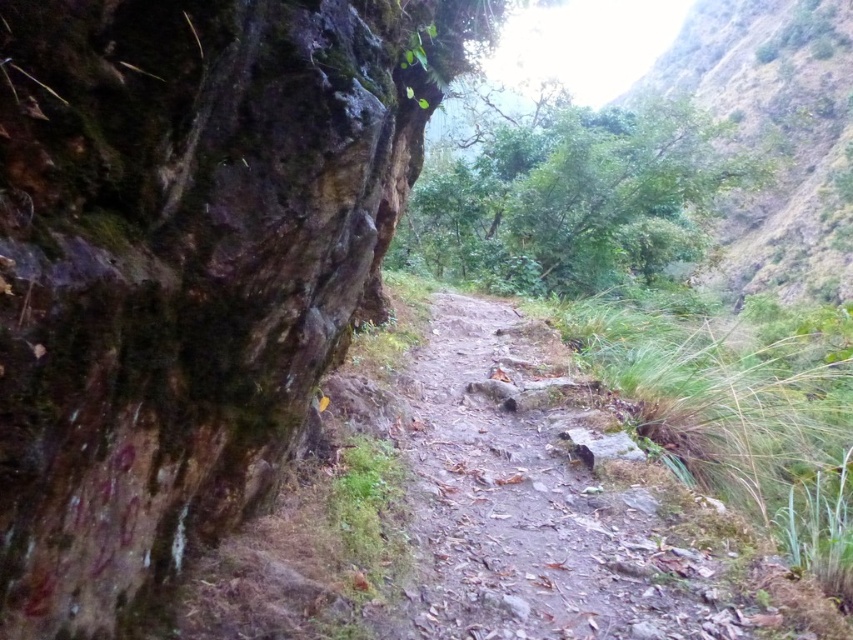
Is point (131, 611) positioned behind point (746, 58)?

No, (131, 611) is in front of (746, 58).

Which is behind, point (38, 353) or point (785, 99)?

The point (785, 99) is more distant.

Where is `green mossy rock at left`? Image resolution: width=853 pixels, height=640 pixels. green mossy rock at left is located at coordinates (184, 262).

Is dusty gravel path at center shorter than green leafy hillside at upper right?

Indeed, dusty gravel path at center has a lesser height compared to green leafy hillside at upper right.

Is the position of dusty gravel path at center less distant than that of green leafy hillside at upper right?

Yes, dusty gravel path at center is in front of green leafy hillside at upper right.

This screenshot has height=640, width=853. I want to click on dusty gravel path at center, so click(x=537, y=500).

Locate an element on the screen. dusty gravel path at center is located at coordinates (537, 500).

Is green mossy rock at left above dusty gravel path at center?

Indeed, green mossy rock at left is positioned over dusty gravel path at center.

Is green mossy rock at left wider than dusty gravel path at center?

No.

Between point (102, 410) and point (514, 589), which one is positioned in front?

Positioned in front is point (102, 410).

Locate an element on the screen. Image resolution: width=853 pixels, height=640 pixels. green mossy rock at left is located at coordinates 184,262.